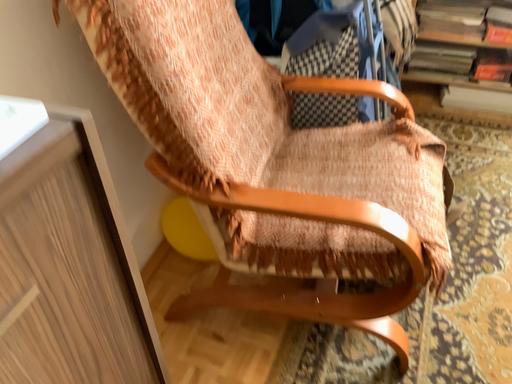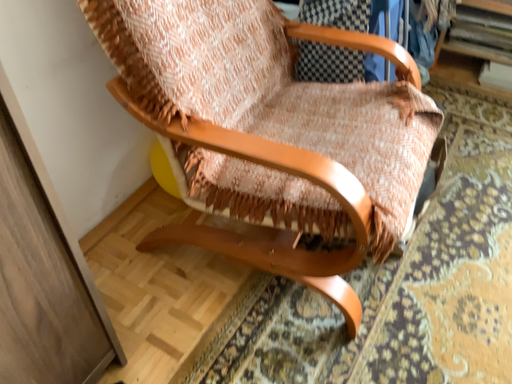
Question: How did the camera likely rotate when shooting the video?

Choices:
 (A) rotated left
 (B) rotated right

Answer: (A)